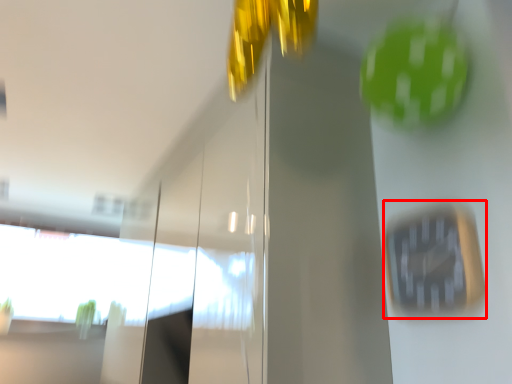
Question: From the image's perspective, where is clock (annotated by the red box) located relative to window?

Choices:
 (A) above
 (B) below

Answer: (A)